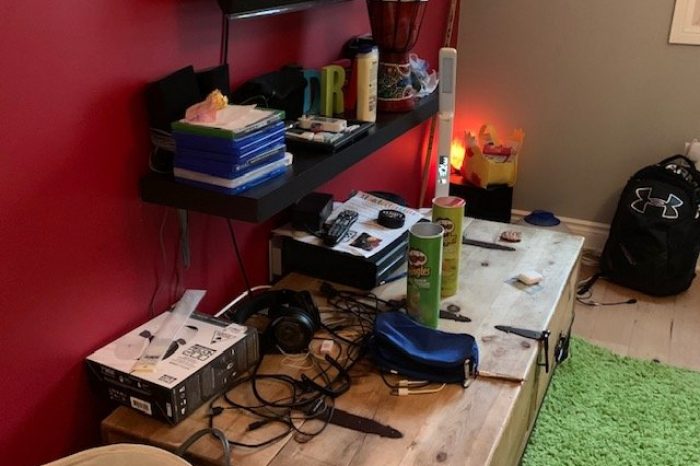
In order to click on green rug or mat in this screenshot , I will do `click(617, 431)`.